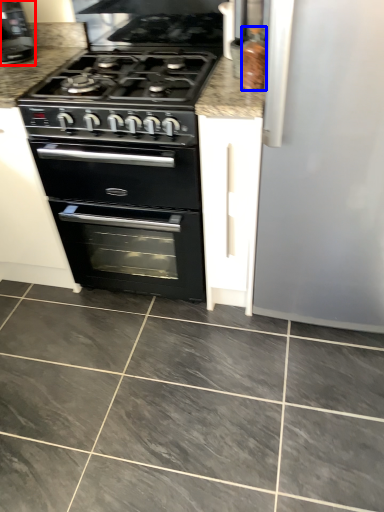
Question: Which point is further to the camera, coffee machine (highlighted by a red box) or appliance (highlighted by a blue box)?

Choices:
 (A) coffee machine
 (B) appliance

Answer: (A)